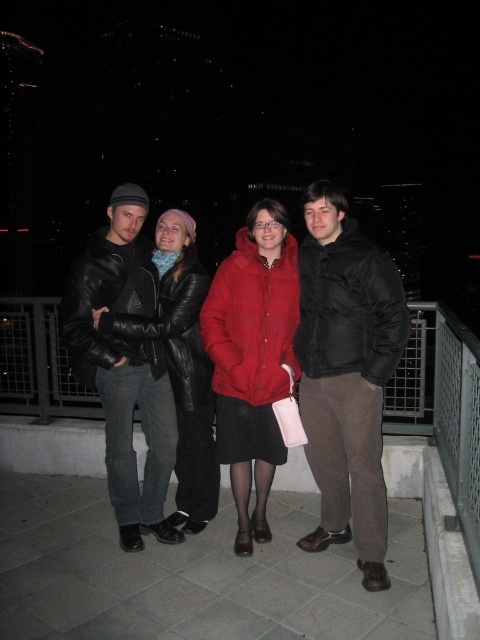
You are a photographer trying to capture a group photo of the leather jacket at left and the matte red coat at center. Since you want to ensure both subjects are in frame, which direction should you position yourself relative to the group?

You should position yourself to the right side of the group so that both the leather jacket at left and the matte red coat at center are visible in your frame.

You are a photographer trying to capture a photo of the group. You want to focus on the point that is closer to you. Which point should you choose between point (343, 195) and point (267, 298)?

Point (343, 195) is closer to the camera than point (267, 298), so you should choose point (343, 195) to focus on.

You are a photographer trying to capture a group photo of the four individuals. You need to ensure that both the black matte jacket at right and the leather jacket at left are clearly visible in the frame. Based on their size in the image, which jacket might require you to adjust your camera angle to ensure it doesn not get cropped out?

The leather jacket at left might require adjusting the camera angle because it occupies more space than the black matte jacket at right, so it might be at risk of being cropped if not framed properly.